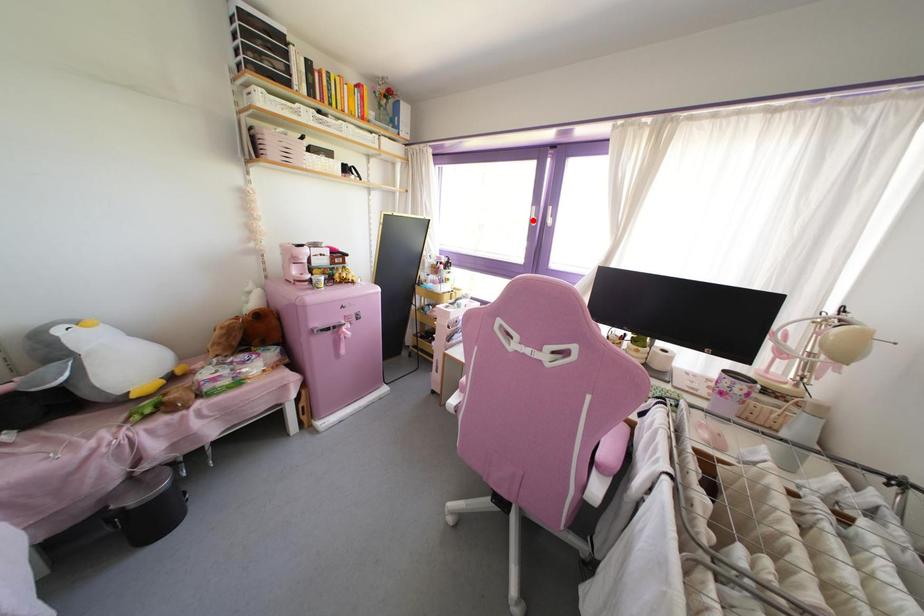
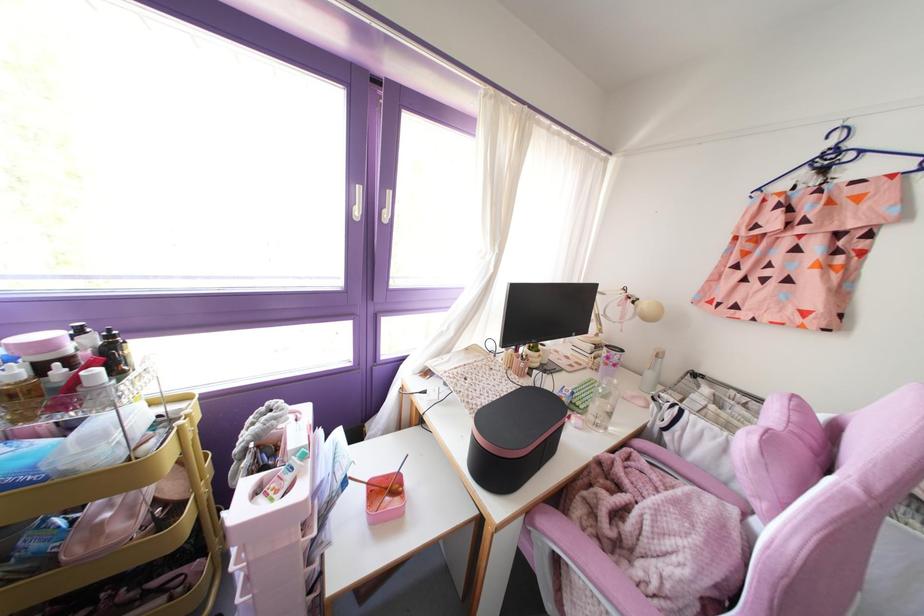
Question: I am providing you with two images of the same scene from different viewpoints. In image1, a red point is highlighted. Considering the same 3D point in image2, which of the following is correct?

Choices:
 (A) It is closer
 (B) It is farther

Answer: (B)